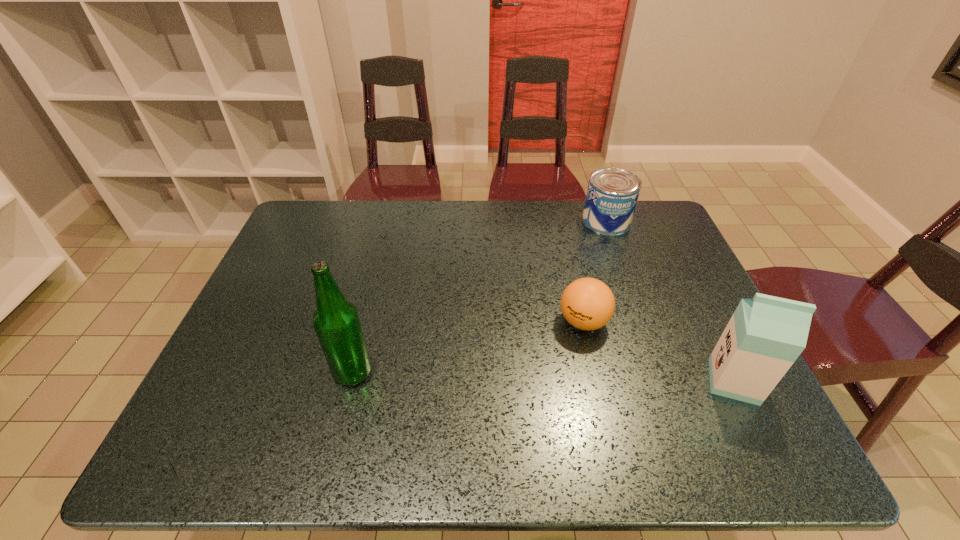
Identify the location of milk carton present at the near edge. (766, 334).

Where is `milk carton situated at the right edge`? The height and width of the screenshot is (540, 960). milk carton situated at the right edge is located at coordinates (766, 334).

Identify the location of can at the right edge. This screenshot has width=960, height=540. (612, 194).

The width and height of the screenshot is (960, 540). I want to click on object at the far right corner, so point(612,194).

Locate an element on the screen. The image size is (960, 540). object that is at the near right corner is located at coordinates (766, 334).

This screenshot has width=960, height=540. Identify the location of vacant space at the far edge. (451, 242).

Image resolution: width=960 pixels, height=540 pixels. I want to click on vacant space at the near edge, so click(398, 383).

At what (x,y) coordinates should I click in order to perform the action: click on vacant space at the left edge of the desktop. Please return your answer as a coordinate pair (x, y). This screenshot has height=540, width=960. Looking at the image, I should click on (242, 356).

Find the location of a particular element. This screenshot has height=540, width=960. vacant space at the right edge is located at coordinates (652, 266).

At what (x,y) coordinates should I click in order to perform the action: click on free location at the far left corner. Please return your answer as a coordinate pair (x, y). Looking at the image, I should click on (305, 208).